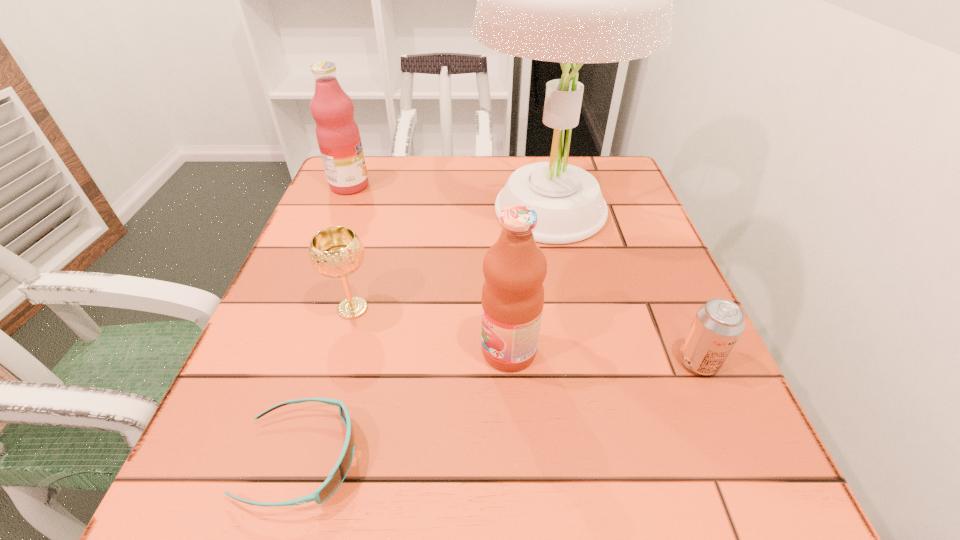
Locate an element on the screen. The height and width of the screenshot is (540, 960). lamp is located at coordinates (571, 0).

Where is `the farther fruit juice`? The width and height of the screenshot is (960, 540). the farther fruit juice is located at coordinates (337, 133).

Locate an element on the screen. the nearer fruit juice is located at coordinates (514, 267).

Find the location of `the fourth nearest object`. the fourth nearest object is located at coordinates (336, 252).

Locate an element on the screen. Image resolution: width=960 pixels, height=540 pixels. chalice is located at coordinates (336, 252).

Locate an element on the screen. The width and height of the screenshot is (960, 540). the second shortest object is located at coordinates (718, 324).

Where is `the nearest object`? The width and height of the screenshot is (960, 540). the nearest object is located at coordinates (337, 475).

You are a GUI agent. You are given a task and a screenshot of the screen. Output one action in this format:
    pyautogui.click(x=<x>, y=<y>)
    Task: Click on the shortest object
    The height and width of the screenshot is (540, 960).
    Given the screenshot: What is the action you would take?
    pyautogui.click(x=337, y=475)

Find the location of a particular element. Image resolution: width=960 pixels, height=540 pixels. vacant space situated 0.090m on the front-facing side of the tallest object is located at coordinates (563, 292).

At what (x,y) coordinates should I click in order to perform the action: click on free space located on the label of the left fruit juice. Please return your answer as a coordinate pair (x, y). The height and width of the screenshot is (540, 960). Looking at the image, I should click on (448, 186).